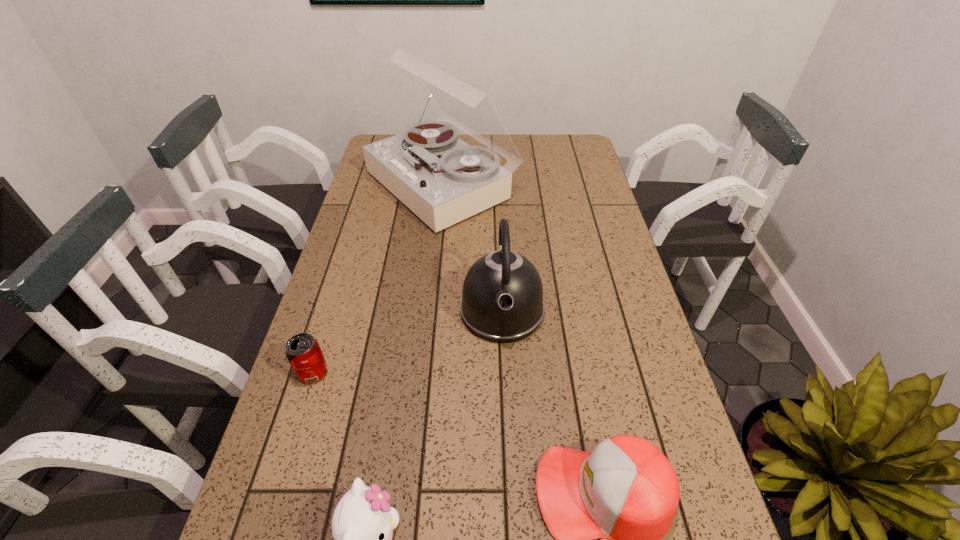
This screenshot has height=540, width=960. Find the location of `soda can that is at the left edge`. soda can that is at the left edge is located at coordinates (303, 352).

Locate an element on the screen. object that is at the far left corner is located at coordinates (443, 180).

Find the location of a particular element. blank space at the far edge of the desktop is located at coordinates (517, 147).

Image resolution: width=960 pixels, height=540 pixels. I want to click on vacant area at the left edge of the desktop, so click(x=328, y=308).

This screenshot has height=540, width=960. What are the coordinates of `vacant space at the right edge of the desktop` in the screenshot? It's located at (551, 167).

Where is `free space at the far right corner`? The image size is (960, 540). free space at the far right corner is located at coordinates (569, 143).

The image size is (960, 540). In order to click on empty space between the second tallest object and the third nearest object in this screenshot , I will do `click(407, 341)`.

Locate an element on the screen. This screenshot has width=960, height=540. vacant space in between the record player and the fourth shortest object is located at coordinates (471, 247).

The height and width of the screenshot is (540, 960). Find the location of `object that is the second closest to the fourth nearest object`. object that is the second closest to the fourth nearest object is located at coordinates (626, 490).

Choose which object is the fourth nearest neighbor to the third tallest object. Please provide its 2D coordinates. Your answer should be formatted as a tuple, i.e. [(x, y)], where the tuple contains the x and y coordinates of a point satisfying the conditions above.

[(443, 180)]